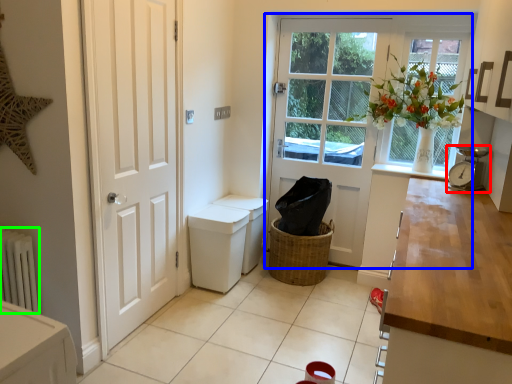
Question: Based on their relative distances, which object is nearer to alarm clock (highlighted by a red box)? Choose from door (highlighted by a blue box) and radiator (highlighted by a green box).

Choices:
 (A) door
 (B) radiator

Answer: (A)